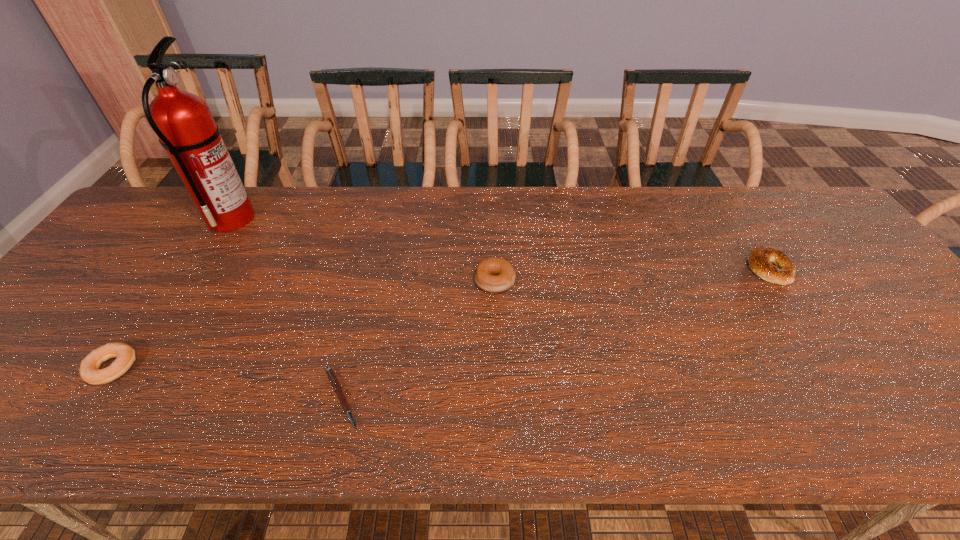
Locate which object is the second closest to the second bagel from left to right. Please provide its 2D coordinates. Your answer should be formatted as a tuple, i.e. [(x, y)], where the tuple contains the x and y coordinates of a point satisfying the conditions above.

[(761, 259)]

The width and height of the screenshot is (960, 540). In order to click on object that can be found as the fourth closest to the leftmost bagel in this screenshot , I will do `click(761, 259)`.

Choose which bagel is the nearest neighbor to the leftmost bagel. Please provide its 2D coordinates. Your answer should be formatted as a tuple, i.e. [(x, y)], where the tuple contains the x and y coordinates of a point satisfying the conditions above.

[(494, 275)]

Identify which bagel is the closest to the rightmost bagel. Please provide its 2D coordinates. Your answer should be formatted as a tuple, i.e. [(x, y)], where the tuple contains the x and y coordinates of a point satisfying the conditions above.

[(494, 275)]

The image size is (960, 540). I want to click on free space in the image that satisfies the following two spatial constraints: 1. at the nozzle of the tallest object; 2. on the left side of the rightmost bagel, so click(200, 268).

Locate an element on the screen. The width and height of the screenshot is (960, 540). free point that satisfies the following two spatial constraints: 1. at the nozzle of the rightmost object; 2. on the left side of the tallest object is located at coordinates (200, 268).

I want to click on vacant space that satisfies the following two spatial constraints: 1. at the nozzle of the farthest object; 2. on the right side of the rightmost object, so click(x=200, y=268).

Where is `vacant space that satisfies the following two spatial constraints: 1. on the back side of the rightmost bagel; 2. on the left side of the nearest bagel`? vacant space that satisfies the following two spatial constraints: 1. on the back side of the rightmost bagel; 2. on the left side of the nearest bagel is located at coordinates (179, 268).

Where is `free spot that satisfies the following two spatial constraints: 1. on the front side of the rightmost object; 2. at the nib of the third object from right to left`? free spot that satisfies the following two spatial constraints: 1. on the front side of the rightmost object; 2. at the nib of the third object from right to left is located at coordinates (852, 398).

You are a GUI agent. You are given a task and a screenshot of the screen. Output one action in this format:
    pyautogui.click(x=<x>, y=<y>)
    Task: Click on the vacant space that satisfies the following two spatial constraints: 1. on the front side of the second bagel from left to right; 2. at the nib of the third object from left to right
    The height and width of the screenshot is (540, 960).
    Given the screenshot: What is the action you would take?
    pyautogui.click(x=498, y=398)